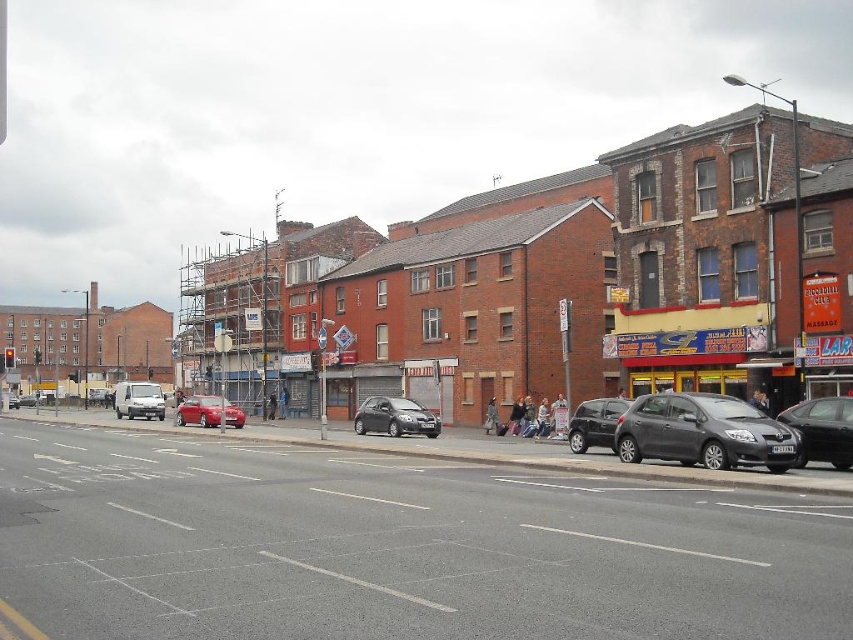
Question: Among these points, which one is nearest to the camera?

Choices:
 (A) (827, 417)
 (B) (636, 445)

Answer: (A)

Question: Can you confirm if dark gray metallic hatchback at lower right is smaller than satin black car at lower right?

Choices:
 (A) no
 (B) yes

Answer: (B)

Question: Is dark gray metallic hatchback at lower right to the left of satin silver hatchback at center from the viewer's perspective?

Choices:
 (A) no
 (B) yes

Answer: (A)

Question: Is dark gray metallic hatchback at lower right bigger than shiny black sedan at right?

Choices:
 (A) no
 (B) yes

Answer: (B)

Question: Among these points, which one is farthest from the camera?

Choices:
 (A) (242, 424)
 (B) (434, 417)
 (C) (666, 458)

Answer: (A)

Question: Among these objects, which one is nearest to the camera?

Choices:
 (A) satin black car at lower right
 (B) metallic red car at center
 (C) dark gray metallic hatchback at lower right

Answer: (C)